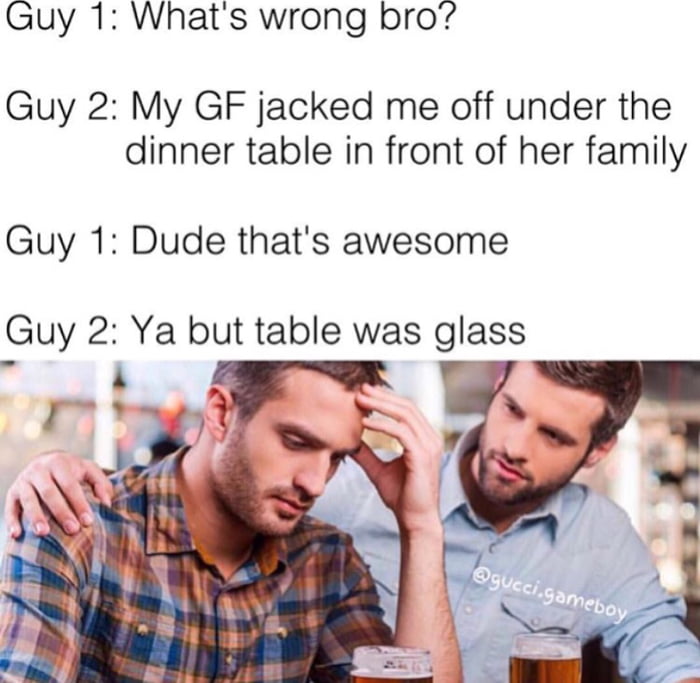
Image resolution: width=700 pixels, height=683 pixels. In order to click on glass in this screenshot , I will do `click(519, 655)`.